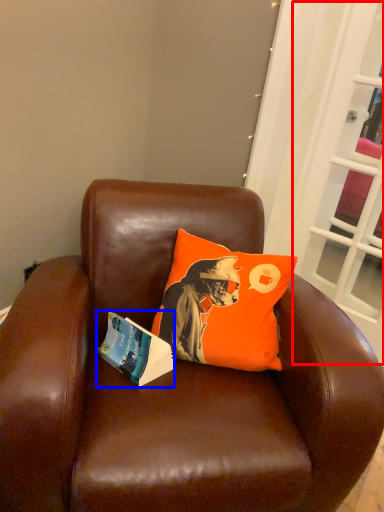
Question: Which point is further to the camera, screen door (highlighted by a red box) or book (highlighted by a blue box)?

Choices:
 (A) screen door
 (B) book

Answer: (A)